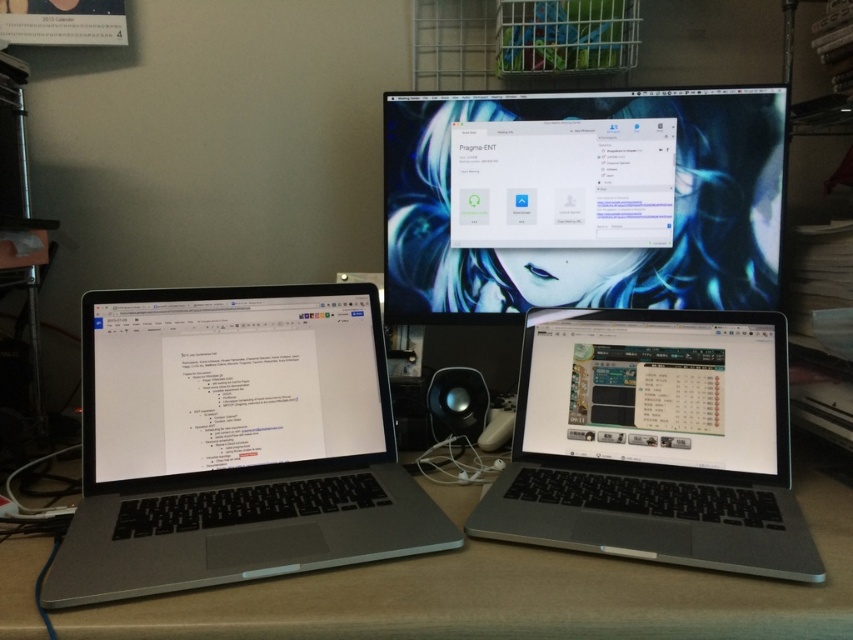
Consider the image. You are organizing cables for the sleek silver laptop at lower right and the satin silver laptop at lower center. Which laptop requires a longer cable to reach the power outlet located behind the monitor?

The sleek silver laptop at lower right requires a longer cable because it is taller than the satin silver laptop at lower center, so it is positioned further back and farther from the power outlet.

You are organizing cables for the slate gray laptop at left and the sleek silver laptop at lower right. Since both are on the same desk, which laptop should you start unplugging cables from first to avoid tangling their power cords?

The slate gray laptop at left should be unplugged first because it is positioned over the sleek silver laptop at lower right, so unplugging it first will prevent the cords from getting tangled with those beneath.